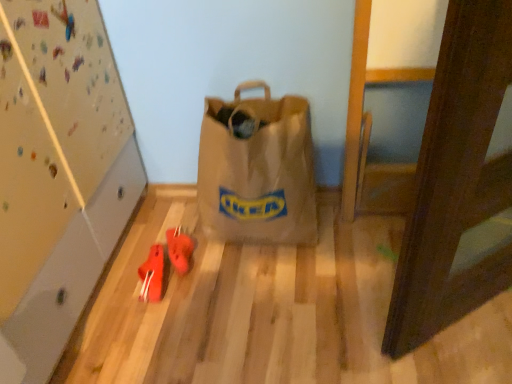
Question: From their relative heights in the image, would you say rubberized red shoes at lower left, acting as the 2th footwear starting from the right, is taller or shorter than brown paper bag at center?

Choices:
 (A) short
 (B) tall

Answer: (A)

Question: Is point (152, 279) positioned closer to the camera than point (298, 236)?

Choices:
 (A) closer
 (B) farther

Answer: (A)

Question: Which object is the closest to the brown paper bag at center?

Choices:
 (A) rubberized red shoes at center, the 2th footwear viewed from the left
 (B) rubberized red shoes at lower left, acting as the 2th footwear starting from the right

Answer: (A)

Question: Which is farther from the rubberized red shoes at lower left, the first footwear when ordered from left to right?

Choices:
 (A) rubberized red shoes at center, which is counted as the 1th footwear, starting from the right
 (B) brown paper bag at center

Answer: (B)